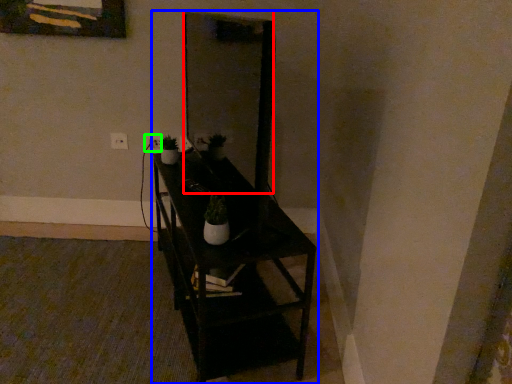
Question: Estimate the real-world distances between objects in this image. Which object is closer to mirror (highlighted by a red box), furniture (highlighted by a blue box) or electric outlet (highlighted by a green box)?

Choices:
 (A) furniture
 (B) electric outlet

Answer: (B)